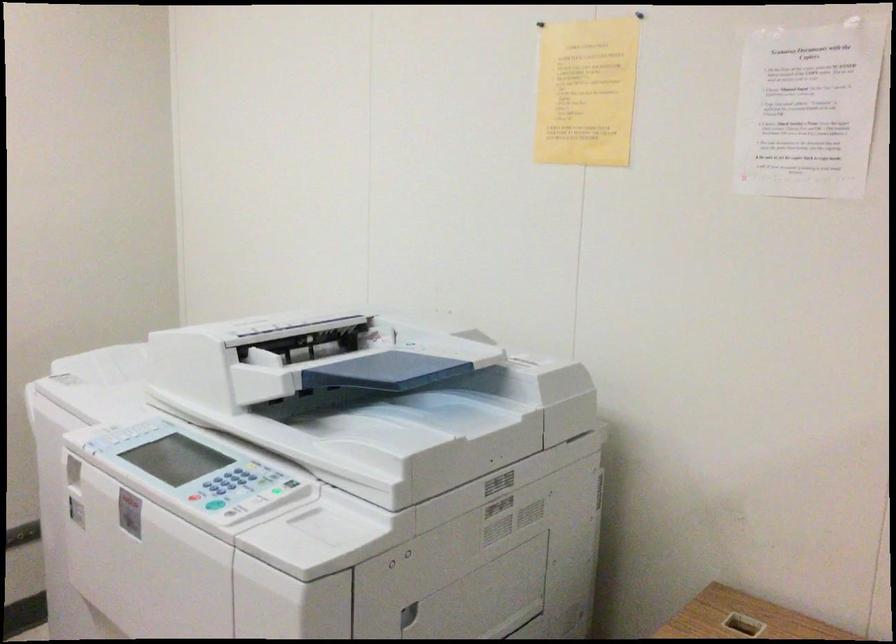
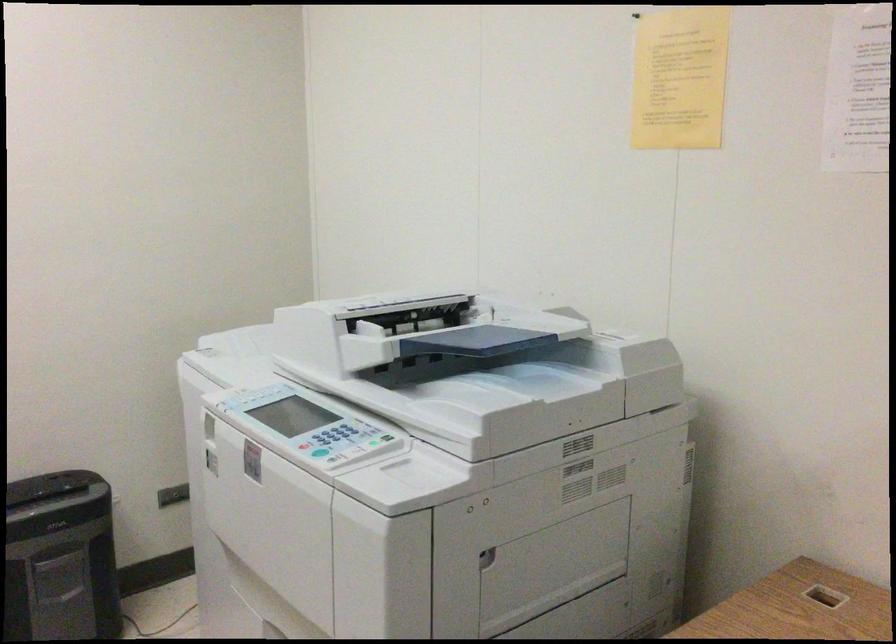
Where in the second image is the point corresponding to point (587, 93) from the first image?

(679, 78)